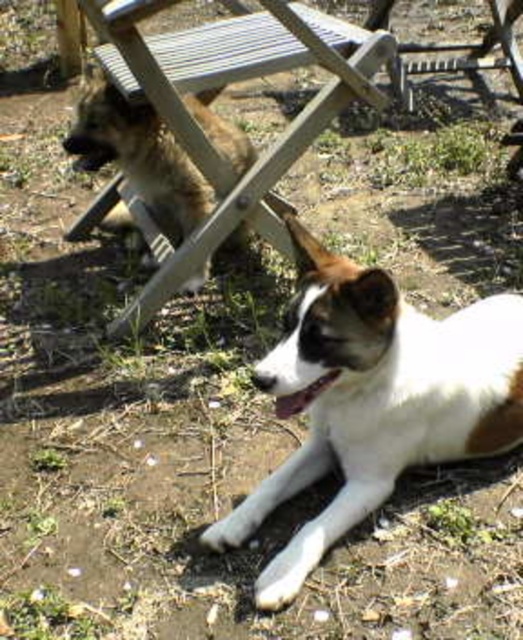
Based on the scene description, where is the white fur dog at lower right located in terms of coordinates?

The white fur dog at lower right is located at coordinates point (373, 397).

You are standing in the backyard and want to place a small garden ornament between the two points, point (481, 433) and point (130, 54). Which point should you place it closer to so that it appears larger in the image?

To make the garden ornament appear larger in the image, place it closer to point (481, 433) since it is closer to the camera than point (130, 54).

You are a photographer setting up a tripod in this scene. You need to position it so that both the white fur dog at lower right and the wooden chair at upper center are visible in the frame. Given their sizes in the image, which object should you ensure is closer to the center of the frame to avoid cropping?

Since the white fur dog at lower right occupies less space than the wooden chair at upper center, you should position the wooden chair at upper center closer to the center of the frame to ensure both are fully visible without cropping.